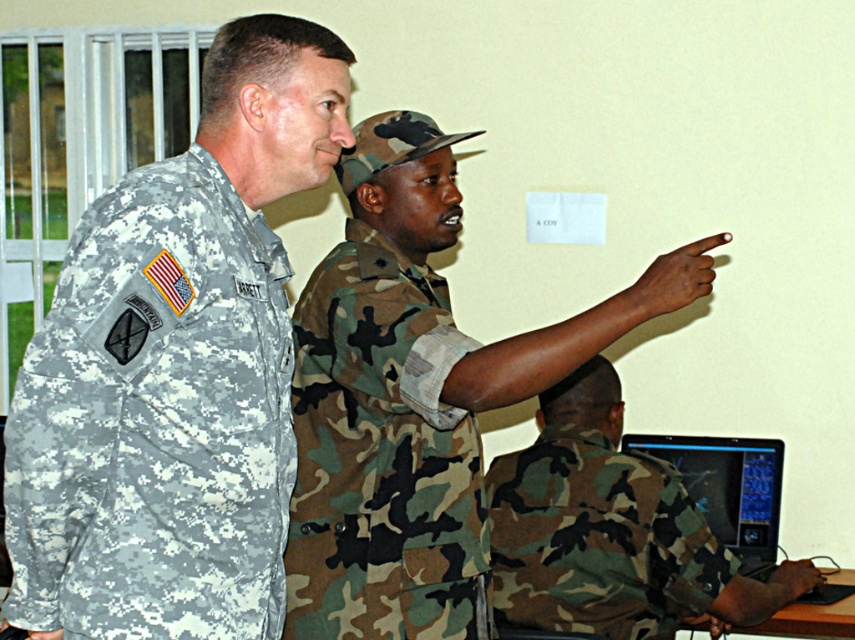
In the scene shown: You are a photographer in the room and want to take a photo of both the camouflage uniform at center and the camo fabric uniform at center. Which one should you focus on first to ensure both are in the frame?

The camouflage uniform at center is in front of the camo fabric uniform at center, so you should focus on the camo fabric uniform at center first to ensure both are in the frame.

You are a photographer in the room and want to take a photo of both the camouflage uniform at center and the camo fabric uniform at center. Which one should you focus on first if you want to capture both in the same frame without moving the camera?

The camouflage uniform at center is located above the camo fabric uniform at center, so you should focus on the camouflage uniform at center first to ensure both are in the frame.

Looking at this image, you are a photographer setting up a shoot in this room. You want to position a large camera on the wooden table at lower right without blocking the view of the camouflage fabric uniform at left. Is this possible?

The camouflage fabric uniform at left is above the wooden table at lower right, so placing the camera on the table would not block its view since the uniform is positioned higher up.